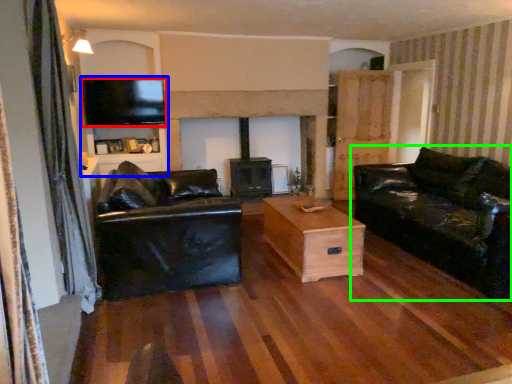
Question: Estimate the real-world distances between objects in this image. Which object is farther from television (highlighted by a red box), entertainment center (highlighted by a blue box) or studio couch (highlighted by a green box)?

Choices:
 (A) entertainment center
 (B) studio couch

Answer: (B)